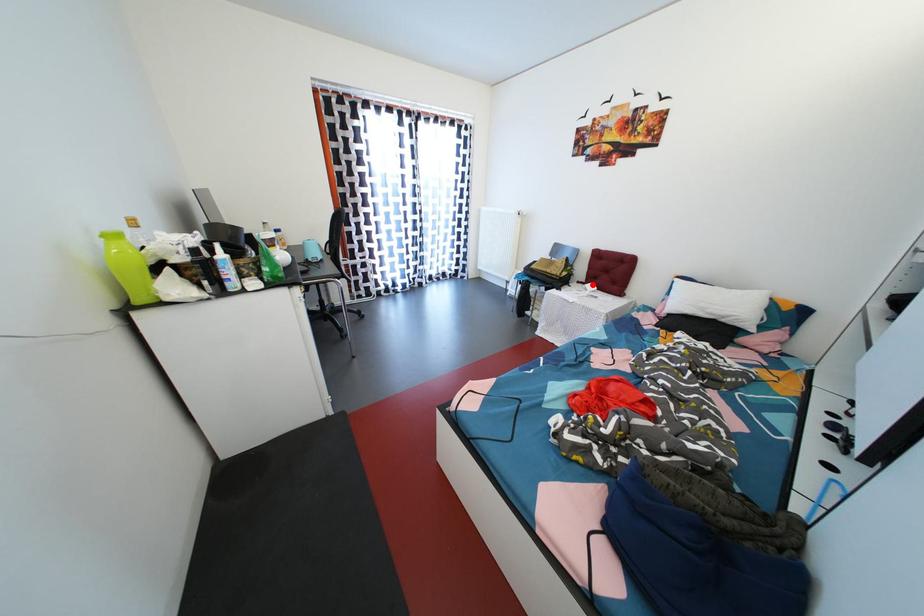
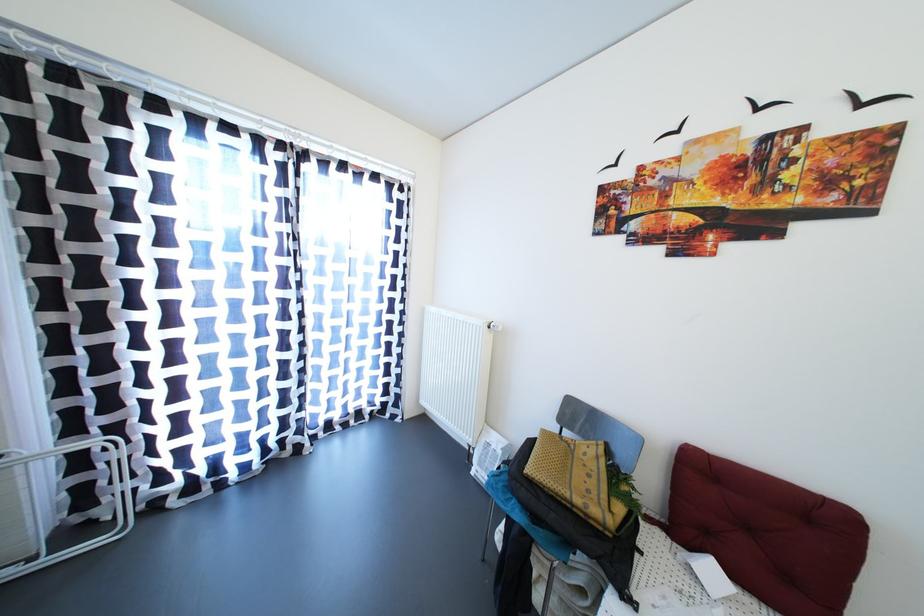
Find the pixel in the second image that matches the highlighted location in the first image.

(677, 525)